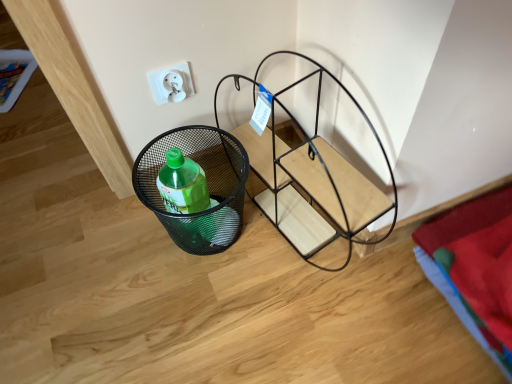
Question: Is black mesh basket at lower left completely or partially outside of black metal wire basket at lower left?

Choices:
 (A) yes
 (B) no

Answer: (A)

Question: Is black mesh basket at lower left looking in the opposite direction of black metal wire basket at lower left?

Choices:
 (A) yes
 (B) no

Answer: (A)

Question: Could you tell me if black mesh basket at lower left is facing black metal wire basket at lower left?

Choices:
 (A) no
 (B) yes

Answer: (A)

Question: From a real-world perspective, is black mesh basket at lower left positioned over black metal wire basket at lower left based on gravity?

Choices:
 (A) yes
 (B) no

Answer: (B)

Question: Does black mesh basket at lower left have a greater width compared to black metal wire basket at lower left?

Choices:
 (A) yes
 (B) no

Answer: (B)

Question: Can you confirm if black mesh basket at lower left is positioned to the right of black metal wire basket at lower left?

Choices:
 (A) yes
 (B) no

Answer: (B)

Question: Considering the relative sizes of black mesh basket at lower left and white plastic electric outlet at upper center in the image provided, is black mesh basket at lower left smaller than white plastic electric outlet at upper center?

Choices:
 (A) yes
 (B) no

Answer: (B)

Question: From a real-world perspective, is black mesh basket at lower left below white plastic electric outlet at upper center?

Choices:
 (A) no
 (B) yes

Answer: (B)

Question: Does black mesh basket at lower left have a lesser width compared to white plastic electric outlet at upper center?

Choices:
 (A) yes
 (B) no

Answer: (B)

Question: Are black mesh basket at lower left and white plastic electric outlet at upper center making contact?

Choices:
 (A) yes
 (B) no

Answer: (B)

Question: Is white plastic electric outlet at upper center at the back of black mesh basket at lower left?

Choices:
 (A) no
 (B) yes

Answer: (A)

Question: Does black mesh basket at lower left have a greater height compared to white plastic electric outlet at upper center?

Choices:
 (A) no
 (B) yes

Answer: (B)

Question: Considering the relative sizes of white plastic electric outlet at upper center and black metal wire basket at lower left in the image provided, is white plastic electric outlet at upper center bigger than black metal wire basket at lower left?

Choices:
 (A) no
 (B) yes

Answer: (A)